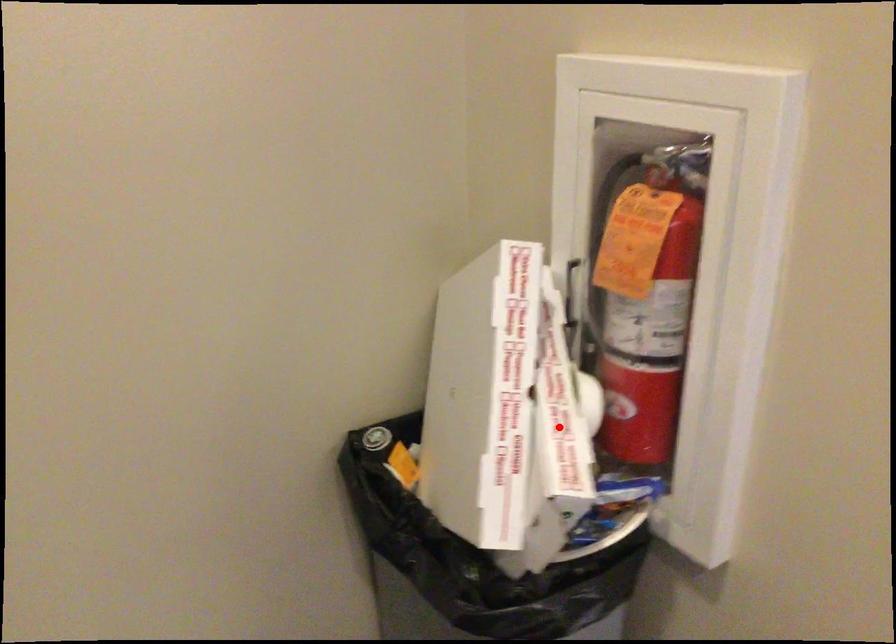
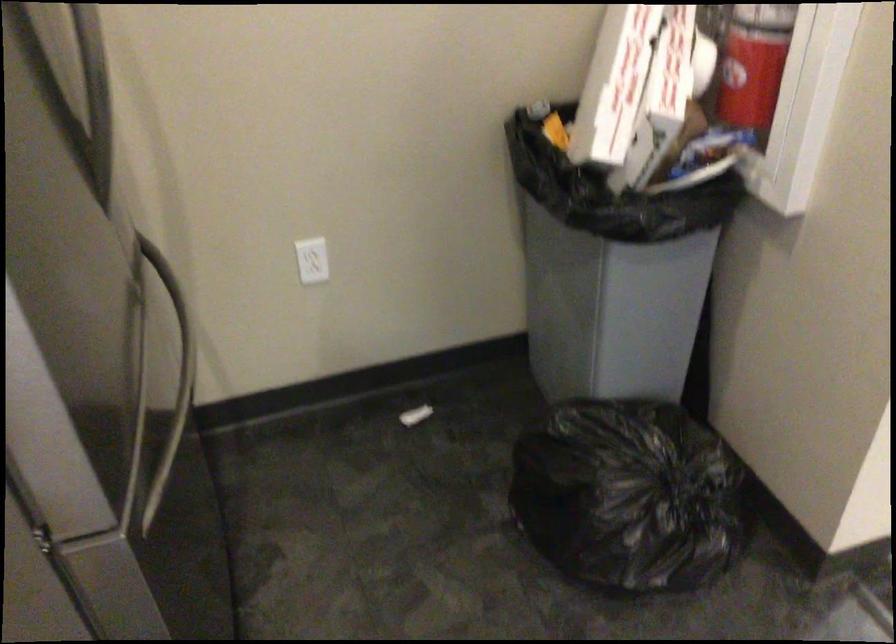
Question: I am providing you with two images of the same scene from different viewpoints. Given a red point in image1, look at the same physical point in image2. Is it:

Choices:
 (A) Closer to the viewpoint
 (B) Farther from the viewpoint

Answer: (B)